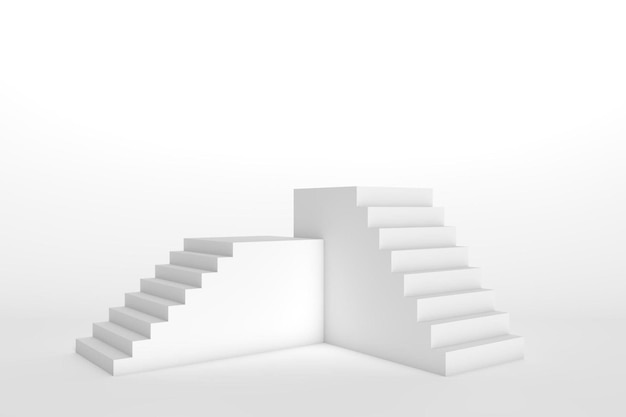
Locate an element on the screen. This screenshot has height=417, width=626. stair risers on left stairway is located at coordinates (106, 364), (121, 337), (133, 327), (158, 309), (173, 290), (185, 272), (200, 261), (220, 248).